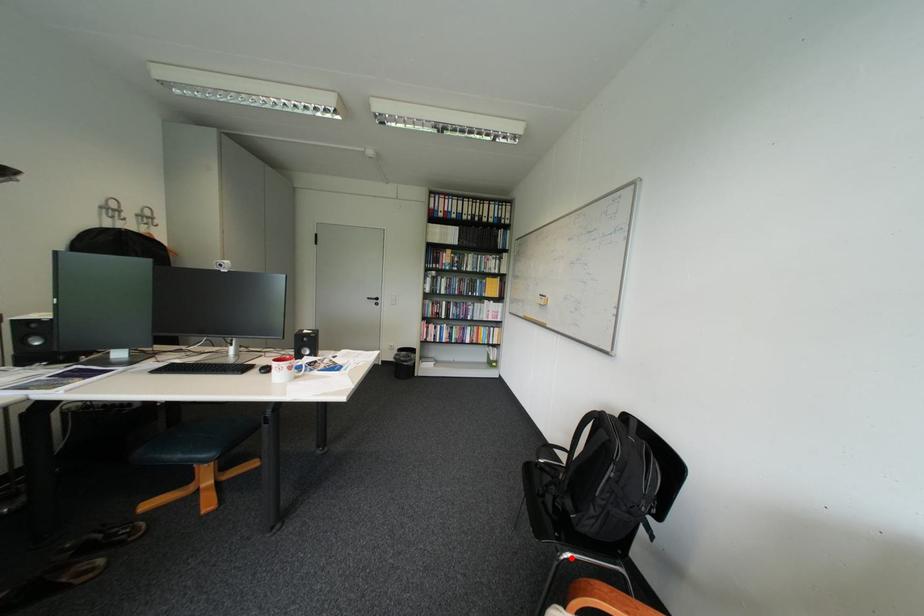
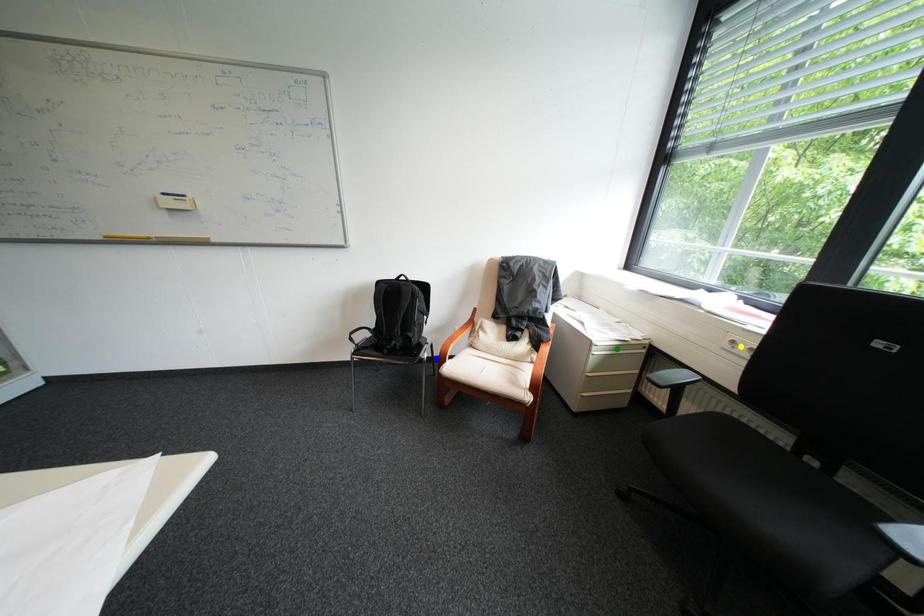
Question: I am providing you with two images of the same scene from different viewpoints. A red point is marked on the first image. You are given multiple points on the second image. Which spot in image 2 lines up with the point in image 1?

Choices:
 (A) blue point
 (B) green point
 (C) yellow point

Answer: (A)